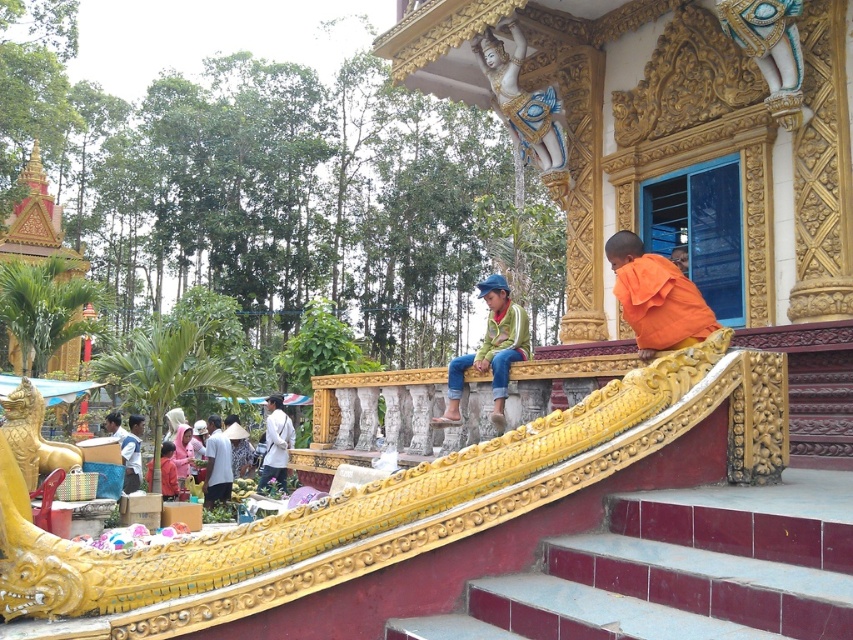
Which is in front, point (488, 637) or point (67, 449)?

Positioned in front is point (488, 637).

Is maroon tile stairs at lower center positioned in front of gold polished statue at lower left?

That is True.

Between point (767, 582) and point (25, 436), which one is positioned in front?

Point (767, 582) is more forward.

Identify the location of maroon tile stairs at lower center. The image size is (853, 640). (679, 572).

Between white glossy statue at upper center and light blue shirt at lower left, which one is positioned lower?

light blue shirt at lower left is below.

Can you confirm if white glossy statue at upper center is positioned to the right of light blue shirt at lower left?

Correct, you'll find white glossy statue at upper center to the right of light blue shirt at lower left.

This screenshot has height=640, width=853. What do you see at coordinates (521, 99) in the screenshot?
I see `white glossy statue at upper center` at bounding box center [521, 99].

This screenshot has height=640, width=853. What are the coordinates of `white glossy statue at upper center` in the screenshot? It's located at (521, 99).

How much distance is there between white glossy statue at upper center and gold polished statue at lower left?

white glossy statue at upper center is 22.82 meters away from gold polished statue at lower left.

Which is more to the right, white glossy statue at upper center or gold polished statue at lower left?

From the viewer's perspective, white glossy statue at upper center appears more on the right side.

Identify the location of white glossy statue at upper center. (521, 99).

Where is `white glossy statue at upper center`? This screenshot has height=640, width=853. white glossy statue at upper center is located at coordinates (521, 99).